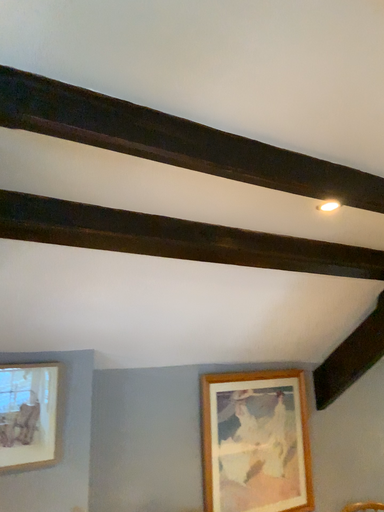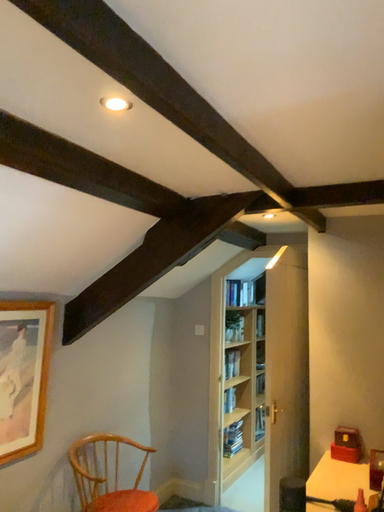
Question: Which way did the camera rotate in the video?

Choices:
 (A) rotated left
 (B) rotated right

Answer: (B)